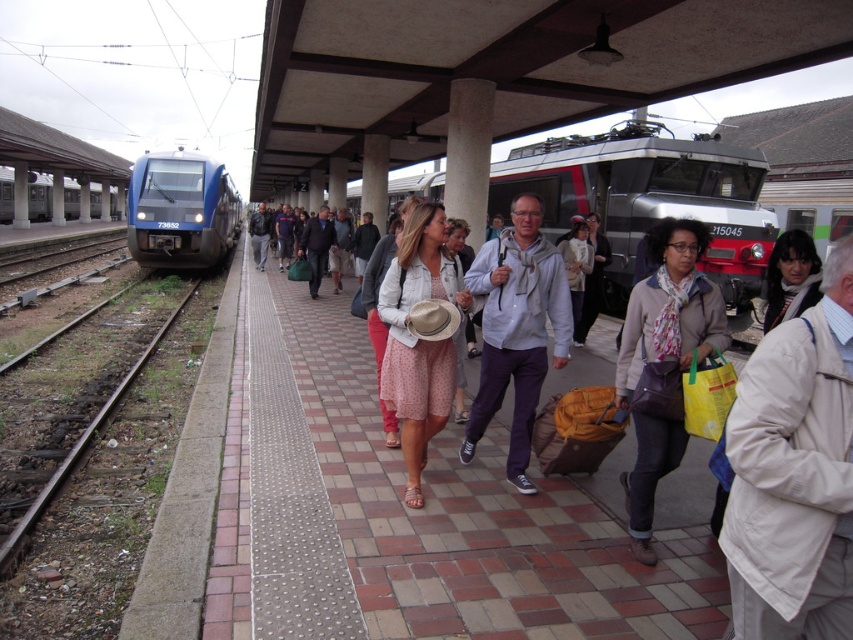
Question: Which point appears closest to the camera in this image?

Choices:
 (A) (729, 189)
 (B) (850, 264)
 (C) (387, 211)
 (D) (80, 445)

Answer: (B)

Question: Is blue glossy train at left bigger than brown gravel train track at left?

Choices:
 (A) yes
 (B) no

Answer: (A)

Question: Among these objects, which one is nearest to the camera?

Choices:
 (A) silver metallic train at center
 (B) blue metallic train at left
 (C) white cotton coat at center

Answer: (C)

Question: Which point is farther to the camera?

Choices:
 (A) (316, 513)
 (B) (792, 515)
 (C) (560, 291)
 (D) (544, 150)

Answer: (D)

Question: Can you confirm if matte beige scarf at center is positioned below light gray hoodie at center?

Choices:
 (A) yes
 (B) no

Answer: (A)

Question: Is light gray hoodie at center bigger than blue metallic train at left?

Choices:
 (A) yes
 (B) no

Answer: (B)